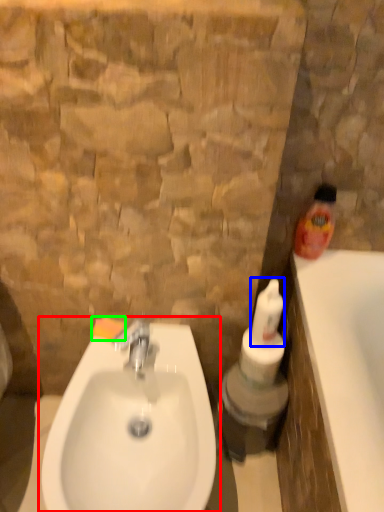
Question: Based on their relative distances, which object is farther from sink (highlighted by a red box)? Choose from cleaning product (highlighted by a blue box) and soap (highlighted by a green box).

Choices:
 (A) cleaning product
 (B) soap

Answer: (A)